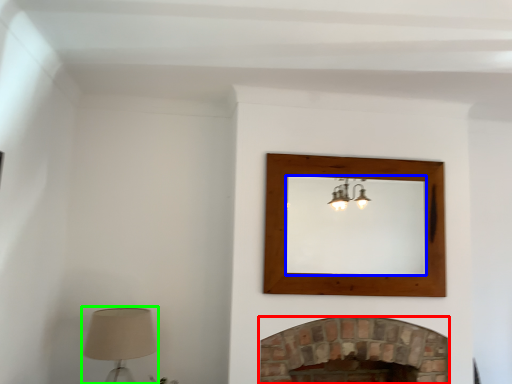
Question: Estimate the real-world distances between objects in this image. Which object is closer to fireplace (highlighted by a red box), mirror (highlighted by a blue box) or table lamp (highlighted by a green box)?

Choices:
 (A) mirror
 (B) table lamp

Answer: (A)